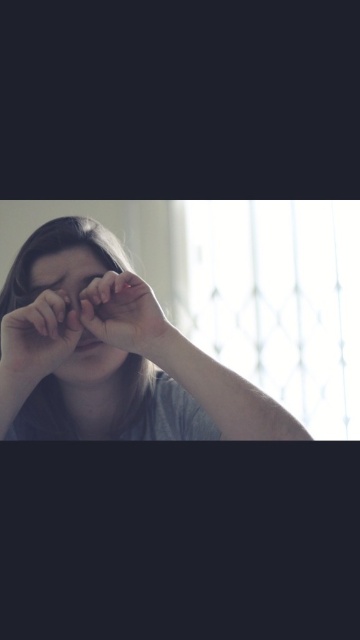
Question: Observing the image, what is the correct spatial positioning of matte gray shirt at center in reference to matte skin at center?

Choices:
 (A) left
 (B) right

Answer: (B)

Question: Is matte black hand at lower left to the right of matte skin hand at center from the viewer's perspective?

Choices:
 (A) no
 (B) yes

Answer: (A)

Question: Which of the following is the farthest from the observer?

Choices:
 (A) matte skin hand at center
 (B) matte skin at center
 (C) matte gray shirt at center

Answer: (B)

Question: Among these objects, which one is farthest from the camera?

Choices:
 (A) matte black hand at lower left
 (B) matte skin hand at center
 (C) matte skin at center

Answer: (C)

Question: Does matte gray shirt at center have a larger size compared to matte black hand at lower left?

Choices:
 (A) no
 (B) yes

Answer: (B)

Question: Among these objects, which one is nearest to the camera?

Choices:
 (A) matte gray shirt at center
 (B) matte black hand at lower left

Answer: (A)